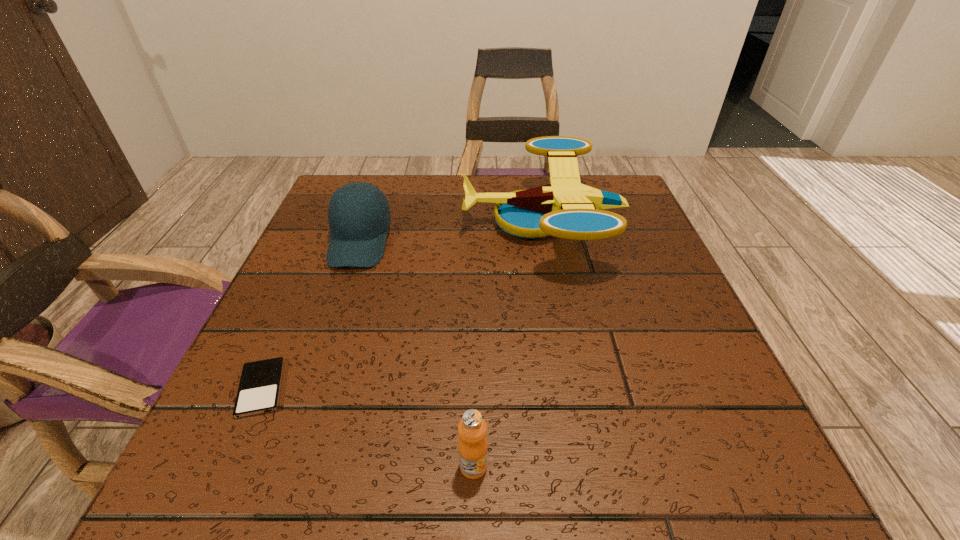
Locate an element on the screen. The image size is (960, 540). drone is located at coordinates (565, 208).

Locate an element on the screen. This screenshot has width=960, height=540. baseball cap is located at coordinates (358, 231).

Find the location of a particular element. Image resolution: width=960 pixels, height=540 pixels. the nearest object is located at coordinates (473, 447).

Locate an element on the screen. This screenshot has width=960, height=540. the shortest object is located at coordinates (259, 389).

Locate an element on the screen. the second nearest object is located at coordinates (259, 389).

This screenshot has width=960, height=540. Identify the location of free location located 0.220m at the cockpit of the drone. (367, 222).

Locate an element on the screen. free space located 0.100m at the cockpit of the drone is located at coordinates (419, 222).

Locate an element on the screen. This screenshot has width=960, height=540. vacant region located at the cockpit of the drone is located at coordinates (396, 222).

This screenshot has width=960, height=540. Identify the location of blank space located 0.070m on the front-facing side of the baseball cap. (341, 298).

At what (x,y) coordinates should I click in order to perform the action: click on free space located 0.400m on the right of the third farthest object. Please return your answer as a coordinate pair (x, y). This screenshot has height=540, width=960. Looking at the image, I should click on (549, 388).